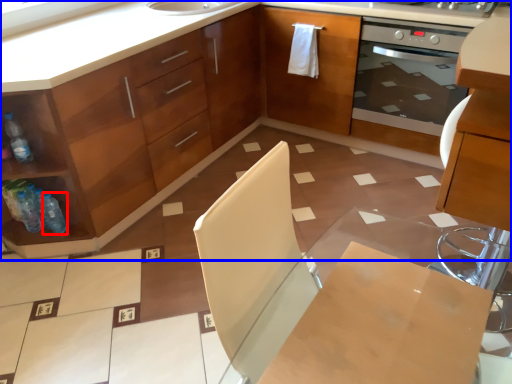
Question: Which of the following is the farthest to the observer, bottle (highlighted by a red box) or cabinetry (highlighted by a blue box)?

Choices:
 (A) bottle
 (B) cabinetry

Answer: (A)